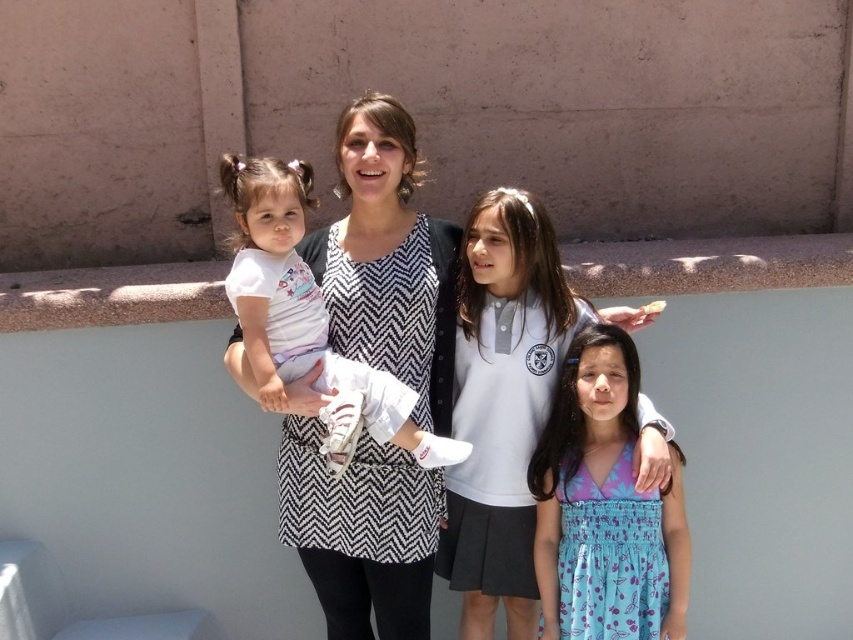
Question: Which point is farther from the camera taking this photo?

Choices:
 (A) (520, 609)
 (B) (387, 490)
 (C) (292, 248)

Answer: (A)

Question: Estimate the real-world distances between objects in this image. Which object is closer to the white cotton shirt at center?

Choices:
 (A) white cotton polo shirt at center
 (B) white cotton shirt at left
 (C) blue floral dress at center

Answer: (B)

Question: Can you confirm if white cotton shirt at center is positioned above white cotton polo shirt at center?

Choices:
 (A) yes
 (B) no

Answer: (A)

Question: Can you confirm if white cotton shirt at center is bigger than blue floral dress at center?

Choices:
 (A) yes
 (B) no

Answer: (A)

Question: Is white cotton shirt at center closer to the viewer compared to blue floral dress at center?

Choices:
 (A) no
 (B) yes

Answer: (B)

Question: Which point appears farthest from the camera in this image?

Choices:
 (A) (596, 339)
 (B) (276, 372)
 (C) (657, 444)
 (D) (318, 515)

Answer: (D)